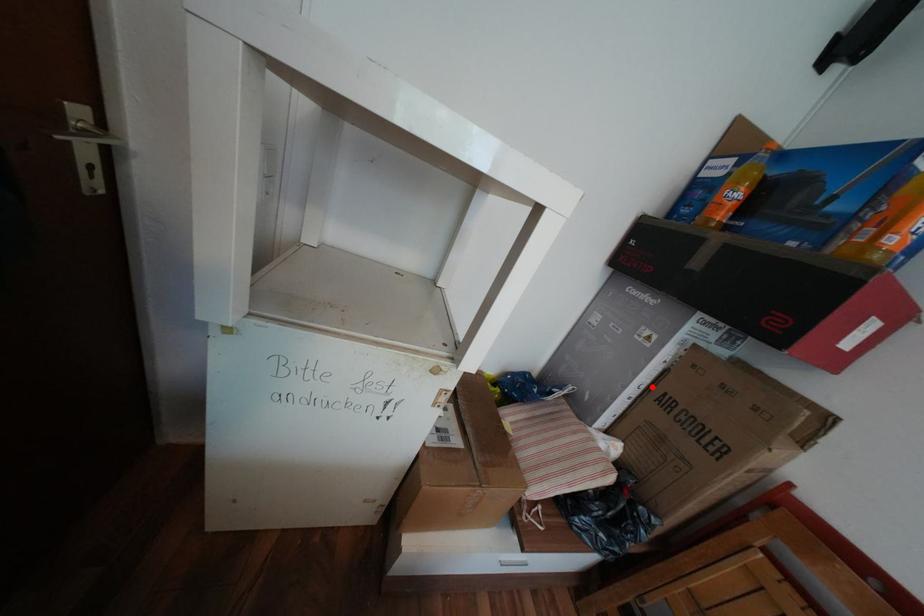
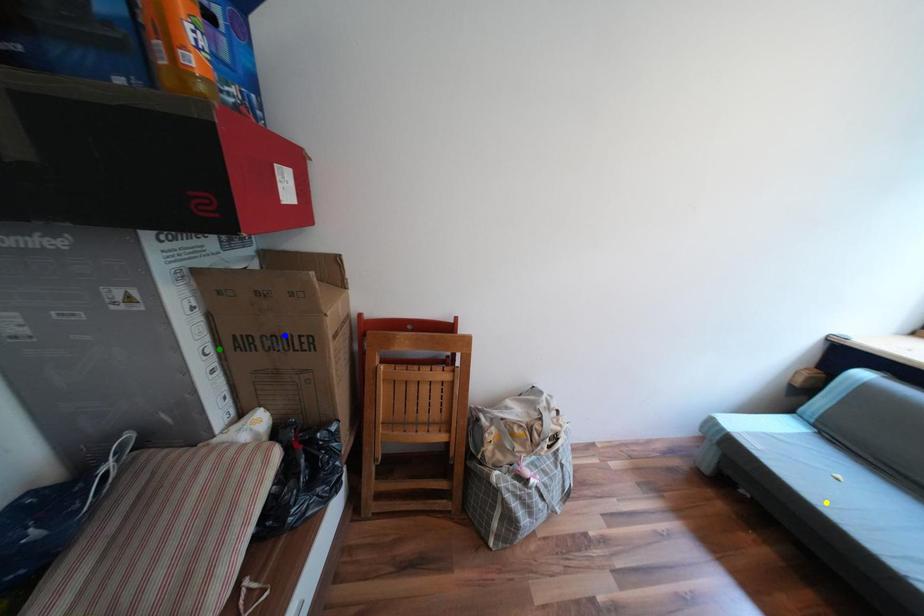
Question: I am providing you with two images of the same scene from different viewpoints. A red point is marked on the first image. You are given multiple points on the second image. Can you choose the point in image 2 that corresponds to the point in image 1?

Choices:
 (A) yellow point
 (B) green point
 (C) blue point

Answer: (B)